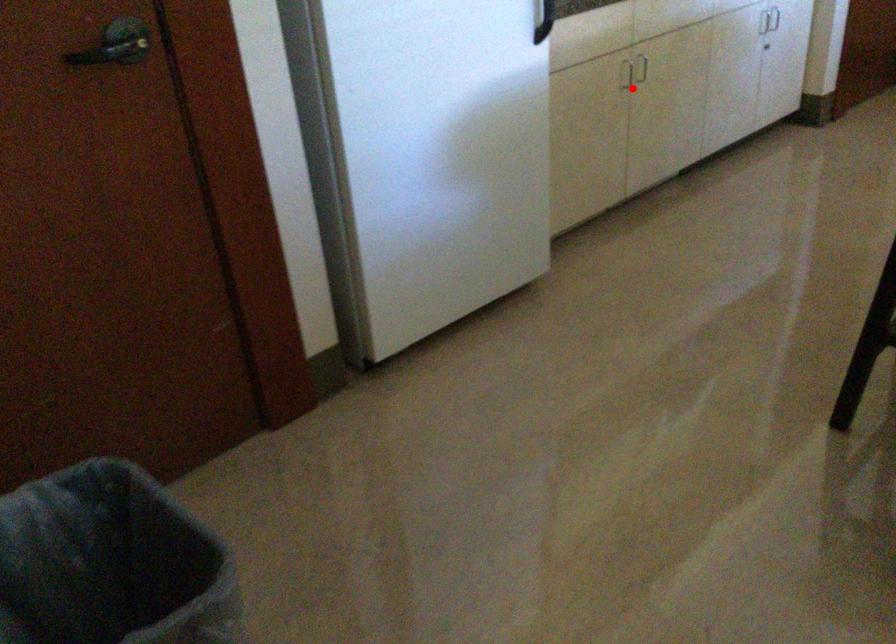
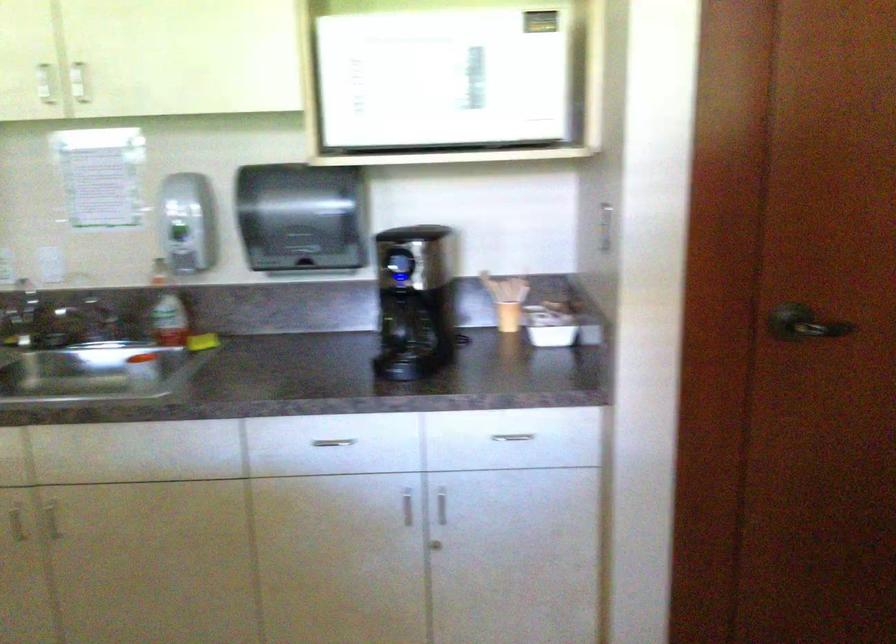
Question: I am providing you with two images of the same scene from different viewpoints. A red point is shown in image1. For the corresponding object point in image2, is it positioned nearer or farther from the camera?

Choices:
 (A) Nearer
 (B) Farther

Answer: (A)